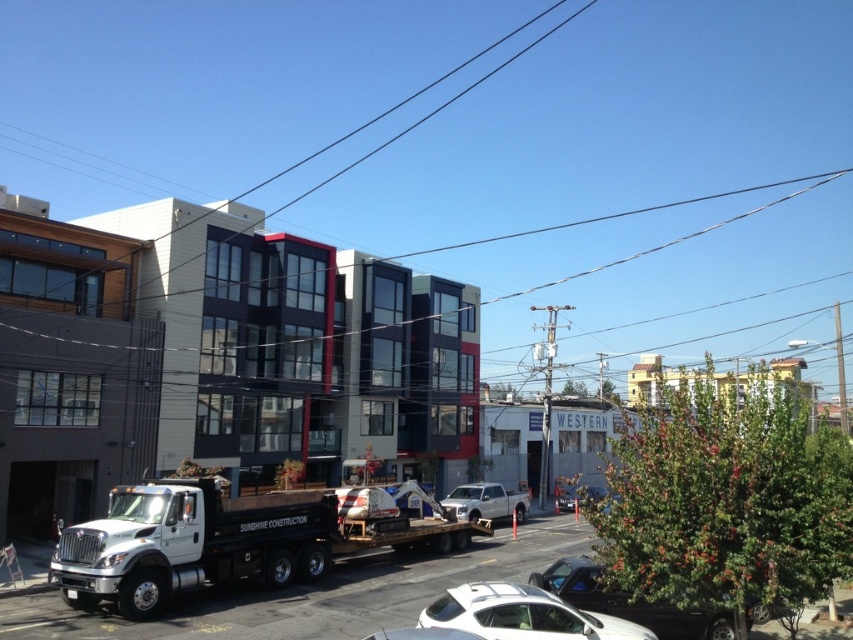
In the scene shown: You are a delivery driver who needs to park your truck between the white matte suv at center and the metallic silver sedan at lower center. Is there enough space between them for your truck?

The white matte suv at center is positioned over the metallic silver sedan at lower center, meaning they are directly on top of each other. There is no space between them, so your truck cannot fit in between.

Looking at this image, you are a delivery person trying to park your truck between the white matte suv at center and the metallic silver sedan at lower center. Can your truck fit in the space between them if your truck is 2 meters wide?

The white matte suv at center is thinner than the metallic silver sedan at lower center, but the exact width of the space between them isn not provided. Without knowing the distance between the two vehicles, it is impossible to determine if the truck can fit.

You are a delivery driver needing to park your vehicle between the white matte suv at center and the white and black dump truck labeled

The distance between the white matte suv at center and the white and black dump truck labeled is 32.95 feet, which is sufficient space for a delivery vehicle to park between them.